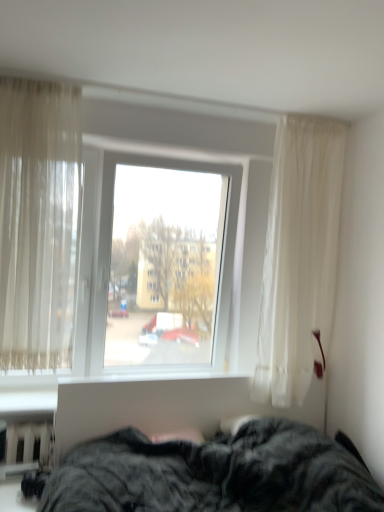
Describe the element at coordinates (39, 223) in the screenshot. I see `sheer beige curtain at left` at that location.

Describe the element at coordinates (28, 448) in the screenshot. I see `white plastic radiator at lower left` at that location.

Measure the distance between point (231,485) and camera.

The depth of point (231,485) is 6.08 feet.

This screenshot has height=512, width=384. Identify the location of dark gray plush bed at lower center. (214, 474).

Locate an element on the screen. Image resolution: width=384 pixels, height=512 pixels. sheer beige curtain at left is located at coordinates (39, 223).

Between point (18, 194) and point (66, 204), which one is positioned in front?

Positioned in front is point (18, 194).

Is transparent glass window at center positioned far away from sheer beige curtain at left?

transparent glass window at center is near sheer beige curtain at left, not far away.

From a real-world perspective, is transparent glass window at center above or below sheer beige curtain at left?

In terms of real-world spatial position, transparent glass window at center is below sheer beige curtain at left.

Can you confirm if transparent glass window at center is taller than sheer beige curtain at left?

In fact, transparent glass window at center may be shorter than sheer beige curtain at left.

From the picture: Is transparent glass window at center with white plastic radiator at lower left?

There is a gap between transparent glass window at center and white plastic radiator at lower left.

From the image's perspective, relative to white plastic radiator at lower left, is transparent glass window at center above or below?

Clearly, from the image's perspective, transparent glass window at center is above white plastic radiator at lower left.

Consider the image. Is transparent glass window at center looking in the opposite direction of white plastic radiator at lower left?

No, transparent glass window at center is not facing away from white plastic radiator at lower left.

Choose the correct answer: Is transparent glass window at center inside white plastic radiator at lower left or outside it?

transparent glass window at center is spatially situated outside white plastic radiator at lower left.

Considering the sizes of dark gray plush bed at lower center and transparent glass window at center in the image, is dark gray plush bed at lower center bigger or smaller than transparent glass window at center?

Clearly, dark gray plush bed at lower center is larger in size than transparent glass window at center.

How distant is dark gray plush bed at lower center from transparent glass window at center?

dark gray plush bed at lower center and transparent glass window at center are 77.65 centimeters apart from each other.

Which is more to the right, dark gray plush bed at lower center or transparent glass window at center?

From the viewer's perspective, dark gray plush bed at lower center appears more on the right side.

How different are the orientations of dark gray plush bed at lower center and transparent glass window at center in degrees?

dark gray plush bed at lower center and transparent glass window at center are facing 0.6 degrees away from each other.

Considering the relative positions of white plastic radiator at lower left and dark gray plush bed at lower center in the image provided, is white plastic radiator at lower left to the left or to the right of dark gray plush bed at lower center?

Based on their positions, white plastic radiator at lower left is located to the left of dark gray plush bed at lower center.

Who is bigger, white plastic radiator at lower left or dark gray plush bed at lower center?

dark gray plush bed at lower center is bigger.

Looking at their sizes, would you say white plastic radiator at lower left is wider or thinner than dark gray plush bed at lower center?

Clearly, white plastic radiator at lower left has less width compared to dark gray plush bed at lower center.

Does dark gray plush bed at lower center lie in front of white plastic radiator at lower left?

Yes, it is in front of white plastic radiator at lower left.

This screenshot has height=512, width=384. In order to click on radiator above the dark gray plush bed at lower center (from a real-world perspective) in this screenshot , I will do `click(28, 448)`.

Is white plastic radiator at lower left at the back of dark gray plush bed at lower center?

Yes, dark gray plush bed at lower center is positioned with its back facing white plastic radiator at lower left.

From a real-world perspective, does dark gray plush bed at lower center stand above white plastic radiator at lower left?

No.

Could white plastic radiator at lower left be considered to be inside sheer beige curtain at left?

No, white plastic radiator at lower left is located outside of sheer beige curtain at left.

Is sheer beige curtain at left far from white plastic radiator at lower left?

They are positioned close to each other.

Is sheer beige curtain at left wider than white plastic radiator at lower left?

Indeed, sheer beige curtain at left has a greater width compared to white plastic radiator at lower left.

Which is in front, sheer beige curtain at left or white plastic radiator at lower left?

sheer beige curtain at left is more forward.

Is sheer beige curtain at left located within dark gray plush bed at lower center?

No.

Considering the relative positions of dark gray plush bed at lower center and sheer beige curtain at left in the image provided, is dark gray plush bed at lower center to the left of sheer beige curtain at left from the viewer's perspective?

No.

Which of these two, dark gray plush bed at lower center or sheer beige curtain at left, is thinner?

sheer beige curtain at left.

Considering the sizes of objects dark gray plush bed at lower center and sheer beige curtain at left in the image provided, who is smaller, dark gray plush bed at lower center or sheer beige curtain at left?

With smaller size is sheer beige curtain at left.

Where is `window behind the sheer beige curtain at left`? The image size is (384, 512). window behind the sheer beige curtain at left is located at coordinates (113, 209).

There is a white plastic radiator at lower left. Identify the location of window above it (from a real-world perspective). The height and width of the screenshot is (512, 384). (113, 209).

Which object lies nearer to the anchor point white plastic radiator at lower left, dark gray plush bed at lower center or sheer beige curtain at left?

dark gray plush bed at lower center is closer to white plastic radiator at lower left.

From the image, which object appears to be nearer to sheer beige curtain at left, white plastic radiator at lower left or dark gray plush bed at lower center?

white plastic radiator at lower left.

When comparing their distances from sheer beige curtain at left, does white plastic radiator at lower left or transparent glass window at center seem closer?

Based on the image, transparent glass window at center appears to be nearer to sheer beige curtain at left.

Considering their positions, is dark gray plush bed at lower center positioned closer to sheer beige curtain at left than white plastic radiator at lower left?

white plastic radiator at lower left lies closer to sheer beige curtain at left than the other object.

From the image, which object appears to be nearer to white plastic radiator at lower left, transparent glass window at center or sheer beige curtain at left?

Based on the image, sheer beige curtain at left appears to be nearer to white plastic radiator at lower left.

Based on their spatial positions, is sheer beige curtain at left or white plastic radiator at lower left closer to dark gray plush bed at lower center?

white plastic radiator at lower left is closer to dark gray plush bed at lower center.

Looking at this image, which object lies further to the anchor point white plastic radiator at lower left, transparent glass window at center or dark gray plush bed at lower center?

transparent glass window at center lies further to white plastic radiator at lower left than the other object.

Considering their positions, is dark gray plush bed at lower center positioned further to sheer beige curtain at left than transparent glass window at center?

dark gray plush bed at lower center.

Locate an element on the screen. This screenshot has height=512, width=384. curtain between dark gray plush bed at lower center and transparent glass window at center in the front-back direction is located at coordinates (39, 223).

The height and width of the screenshot is (512, 384). I want to click on radiator between sheer beige curtain at left and dark gray plush bed at lower center in the up-down direction, so click(28, 448).

The width and height of the screenshot is (384, 512). Find the location of `radiator positioned between dark gray plush bed at lower center and transparent glass window at center from near to far`. radiator positioned between dark gray plush bed at lower center and transparent glass window at center from near to far is located at coordinates (28, 448).

You are a GUI agent. You are given a task and a screenshot of the screen. Output one action in this format:
    pyautogui.click(x=<x>, y=<y>)
    Task: Click on the window between sheer beige curtain at left and white plastic radiator at lower left from top to bottom
    
    Given the screenshot: What is the action you would take?
    pyautogui.click(x=113, y=209)